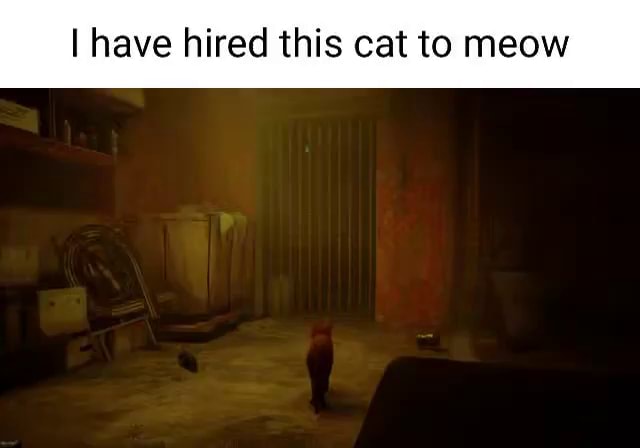
The height and width of the screenshot is (448, 640). I want to click on table, so click(434, 407).